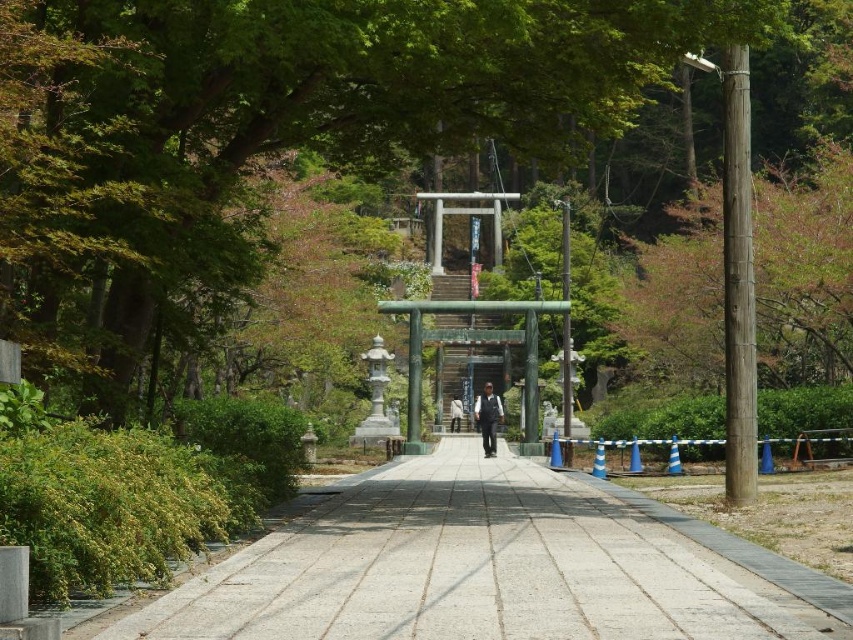
Is green leafy tree at center thinner than black fabric jacket at center?

No.

I want to click on green leafy tree at center, so click(276, 125).

Is black fabric jacket at center to the left of green polished stone torii gate at center from the viewer's perspective?

Yes, black fabric jacket at center is to the left of green polished stone torii gate at center.

Is point (485, 394) positioned in front of point (466, 369)?

That is True.

Does point (485, 433) come closer to viewer compared to point (498, 364)?

Yes, it is in front of point (498, 364).

The width and height of the screenshot is (853, 640). What are the coordinates of `black fabric jacket at center` in the screenshot? It's located at (488, 419).

Does gray concrete pavement at center come in front of black fabric jacket at center?

Yes, it is.

Between point (619, 548) and point (476, 412), which one is positioned behind?

Point (476, 412)

Image resolution: width=853 pixels, height=640 pixels. In order to click on gray concrete pavement at center in this screenshot , I will do `click(494, 566)`.